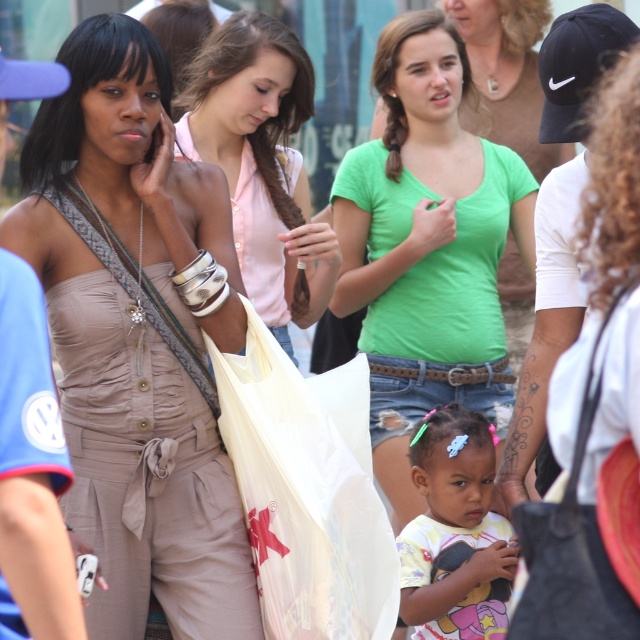
Question: Where is green cotton shirt at center located in relation to white plastic bag at center in the image?

Choices:
 (A) left
 (B) right

Answer: (B)

Question: Estimate the real-world distances between objects in this image. Which object is farther from the matte beige jumpsuit at center?

Choices:
 (A) green cotton shirt at center
 (B) pink satin blouse at center
 (C) pastel yellow t-shirt at center

Answer: (A)

Question: Is green cotton shirt at center below pastel yellow t-shirt at center?

Choices:
 (A) yes
 (B) no

Answer: (B)

Question: Can you confirm if matte beige jumpsuit at center is thinner than white plastic bag at center?

Choices:
 (A) yes
 (B) no

Answer: (B)

Question: Which is nearer to the pastel yellow t-shirt at center?

Choices:
 (A) white plastic bag at center
 (B) matte beige jumpsuit at center
 (C) pink satin blouse at center
 (D) green cotton shirt at center

Answer: (A)

Question: Based on their relative distances, which object is farther from the matte beige jumpsuit at center?

Choices:
 (A) white plastic bag at center
 (B) pastel yellow t-shirt at center
 (C) green cotton shirt at center

Answer: (C)